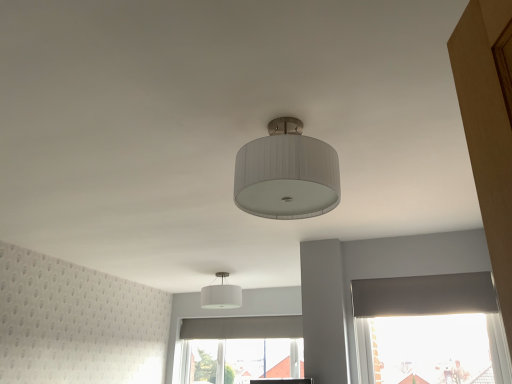
Question: From a real-world perspective, is white textured lampshade at center, the second lamp viewed from the back, physically above white fabric lampshade at center, positioned as the second lamp in front-to-back order?

Choices:
 (A) no
 (B) yes

Answer: (A)

Question: Considering the relative sizes of white textured lampshade at center, arranged as the second lamp when viewed from the left, and white fabric lampshade at center, positioned as the second lamp in front-to-back order, in the image provided, is white textured lampshade at center, arranged as the second lamp when viewed from the left, taller than white fabric lampshade at center, positioned as the second lamp in front-to-back order,?

Choices:
 (A) yes
 (B) no

Answer: (A)

Question: Is white textured lampshade at center, which is counted as the 2th lamp, starting from the bottom, bigger than white fabric lampshade at center, which is the second lamp from top to bottom?

Choices:
 (A) yes
 (B) no

Answer: (A)

Question: Is white textured lampshade at center, which is counted as the 2th lamp, starting from the bottom, in contact with white fabric lampshade at center, acting as the 1th lamp starting from the bottom?

Choices:
 (A) no
 (B) yes

Answer: (A)

Question: Considering the relative sizes of white textured lampshade at center, which is the first lamp from right to left, and white fabric lampshade at center, which is the second lamp from top to bottom, in the image provided, is white textured lampshade at center, which is the first lamp from right to left, wider than white fabric lampshade at center, which is the second lamp from top to bottom,?

Choices:
 (A) yes
 (B) no

Answer: (B)

Question: Is white textured lampshade at center, acting as the 1th lamp starting from the top, aimed at white fabric lampshade at center, acting as the second lamp starting from the right?

Choices:
 (A) no
 (B) yes

Answer: (A)

Question: Is white fabric lampshade at center, which is the second lamp from top to bottom, completely or partially inside transparent plastic window screen at lower right?

Choices:
 (A) yes
 (B) no

Answer: (B)

Question: Is transparent plastic window screen at lower right not within white fabric lampshade at center, which is the second lamp from top to bottom?

Choices:
 (A) no
 (B) yes

Answer: (B)

Question: Does transparent plastic window screen at lower right have a larger size compared to white fabric lampshade at center, positioned as the second lamp in front-to-back order?

Choices:
 (A) no
 (B) yes

Answer: (B)

Question: From the image's perspective, is transparent plastic window screen at lower right located above white fabric lampshade at center, which is the second lamp from top to bottom?

Choices:
 (A) yes
 (B) no

Answer: (B)

Question: Is transparent plastic window screen at lower right at the left side of white fabric lampshade at center, acting as the 1th lamp starting from the bottom?

Choices:
 (A) yes
 (B) no

Answer: (B)

Question: Considering the relative sizes of transparent plastic window screen at lower right and white fabric lampshade at center, which ranks as the 1th lamp in left-to-right order, in the image provided, is transparent plastic window screen at lower right wider than white fabric lampshade at center, which ranks as the 1th lamp in left-to-right order,?

Choices:
 (A) no
 (B) yes

Answer: (A)

Question: Would you say white textured lampshade at center, the second lamp viewed from the back, is part of transparent plastic window screen at lower right's contents?

Choices:
 (A) yes
 (B) no

Answer: (B)